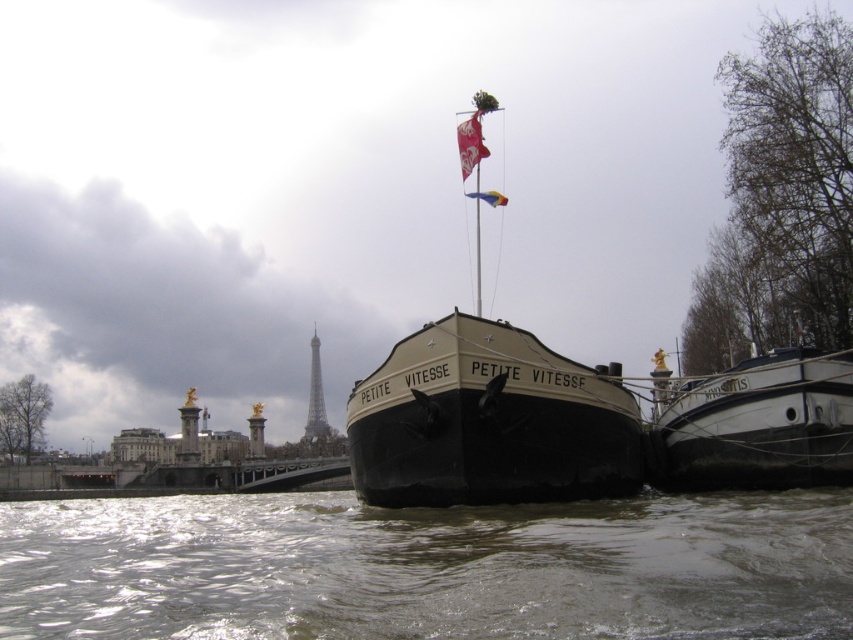
Based on the photo, between black matte barge at center and red fabric flag at upper center, which one has less height?

With less height is red fabric flag at upper center.

Does point (521, 397) lie in front of point (467, 144)?

Yes.

Who is more distant from viewer, (498, 353) or (457, 144)?

Positioned behind is point (457, 144).

This screenshot has height=640, width=853. What are the coordinates of `black matte barge at center` in the screenshot? It's located at (489, 419).

Does white matte boat at right appear under metallic gray tower at center?

Incorrect, white matte boat at right is not positioned below metallic gray tower at center.

Between point (751, 381) and point (317, 340), which one is positioned behind?

Point (317, 340)

Describe the element at coordinates (756, 424) in the screenshot. I see `white matte boat at right` at that location.

At what (x,y) coordinates should I click in order to perform the action: click on white matte boat at right. Please return your answer as a coordinate pair (x, y). Looking at the image, I should click on (756, 424).

Does point (86, 593) come closer to viewer compared to point (780, 372)?

That is True.

Can you confirm if brown murky water at lower center is positioned to the left of white matte boat at right?

Indeed, brown murky water at lower center is positioned on the left side of white matte boat at right.

Where is `brown murky water at lower center`? The image size is (853, 640). brown murky water at lower center is located at coordinates (428, 568).

I want to click on brown murky water at lower center, so click(428, 568).